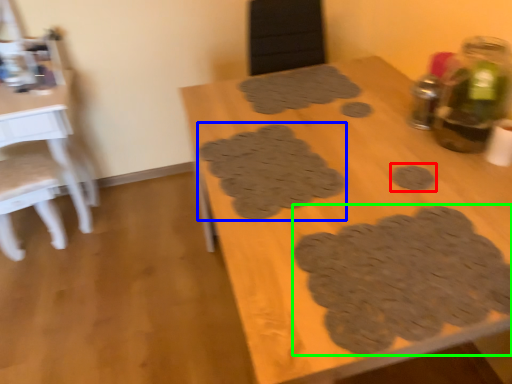
Question: Which is nearer to the footprint (highlighted by a red box)? footprint (highlighted by a blue box) or footprint (highlighted by a green box).

Choices:
 (A) footprint
 (B) footprint

Answer: (B)